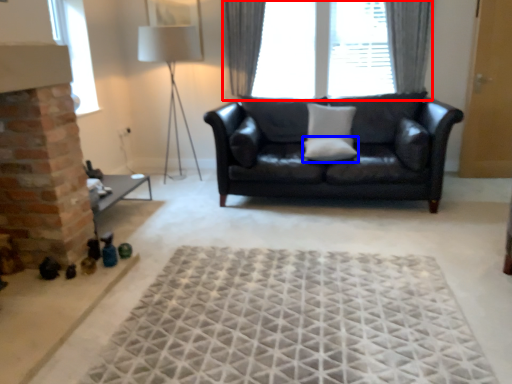
Question: Among these objects, which one is farthest to the camera, window (highlighted by a red box) or pillow (highlighted by a blue box)?

Choices:
 (A) window
 (B) pillow

Answer: (A)